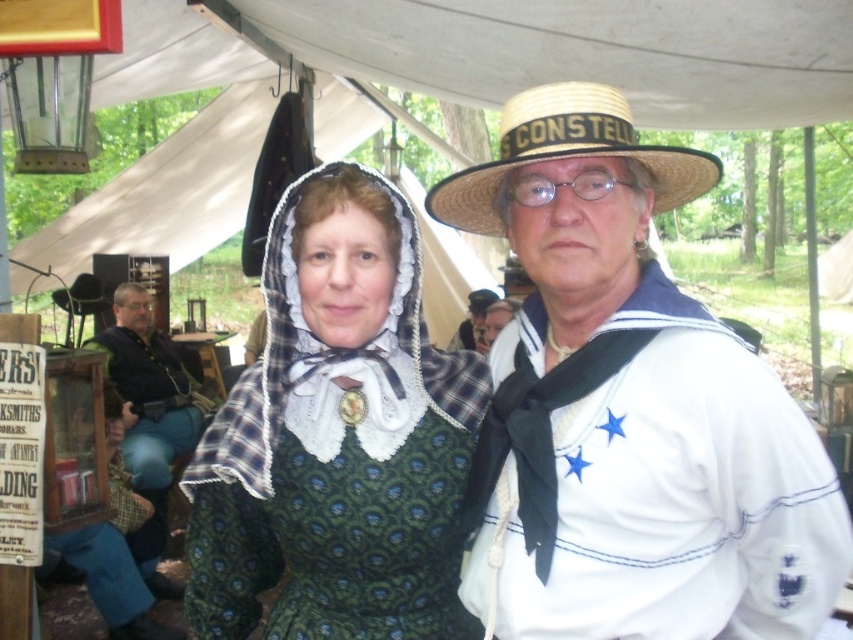
From the picture: You are a costume designer observing the historical reenactment. You need to determine which costume reaches lower on the legs between the matte green dress at center and the dark blue denim pants at left. Which one is longer?

The dark blue denim pants at left are longer than the matte green dress at center, so the dark blue denim pants at left reach lower on the legs.

You are standing at the entrance of the tent and see the point marked at coordinates (628, 410). What object is located at that point?

The point marked at coordinates (628, 410) is located at the matte green dress at center.